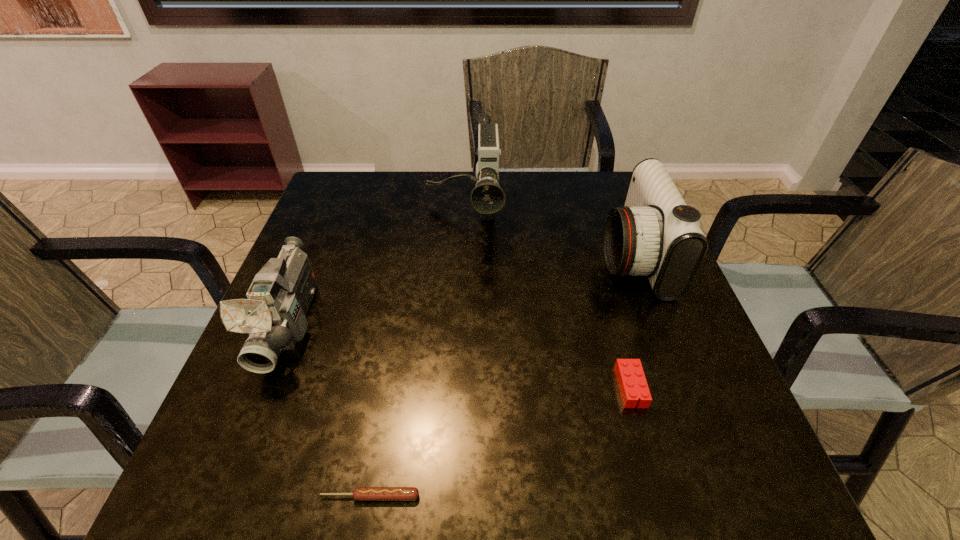
You are a GUI agent. You are given a task and a screenshot of the screen. Output one action in this format:
    pyautogui.click(x=<x>, y=<y>)
    Task: Click on the empty space that is in between the shortest object and the fourth tallest object
    This screenshot has height=540, width=960.
    Given the screenshot: What is the action you would take?
    pyautogui.click(x=500, y=442)

Where is `vacant point located between the leftmost camcorder and the rightmost camcorder`? vacant point located between the leftmost camcorder and the rightmost camcorder is located at coordinates (462, 290).

The image size is (960, 540). I want to click on free space between the leftmost object and the nearest object, so click(x=330, y=410).

Locate an element on the screen. the second closest object to the nearest object is located at coordinates (632, 383).

Select which object is the third closest to the Lego. Please provide its 2D coordinates. Your answer should be formatted as a tuple, i.e. [(x, y)], where the tuple contains the x and y coordinates of a point satisfying the conditions above.

[(487, 198)]

Locate which camcorder ranks second in proximity to the Lego. Please provide its 2D coordinates. Your answer should be formatted as a tuple, i.e. [(x, y)], where the tuple contains the x and y coordinates of a point satisfying the conditions above.

[(487, 198)]

Identify which camcorder is located as the second nearest to the sausage. Please provide its 2D coordinates. Your answer should be formatted as a tuple, i.e. [(x, y)], where the tuple contains the x and y coordinates of a point satisfying the conditions above.

[(656, 234)]

Locate an element on the screen. Image resolution: width=960 pixels, height=540 pixels. free space that satisfies the following two spatial constraints: 1. on the front-facing side of the sausage; 2. on the right side of the leftmost camcorder is located at coordinates (222, 496).

Where is `blank space that satisfies the following two spatial constraints: 1. on the surface of the rightmost camcorder; 2. on the front-facing side of the leftmost camcorder`? The image size is (960, 540). blank space that satisfies the following two spatial constraints: 1. on the surface of the rightmost camcorder; 2. on the front-facing side of the leftmost camcorder is located at coordinates (658, 324).

Image resolution: width=960 pixels, height=540 pixels. What are the coordinates of `free region that satisfies the following two spatial constraints: 1. on the front-facing side of the Lego; 2. on the left side of the leftmost camcorder` in the screenshot? It's located at (266, 387).